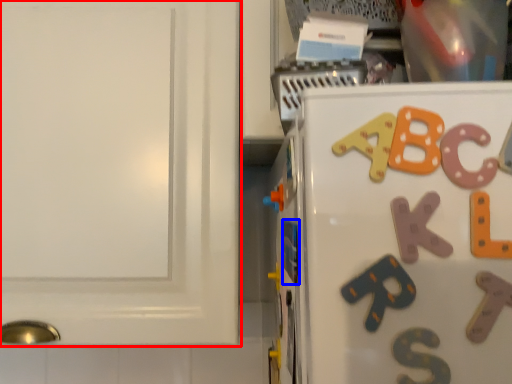
Question: Among these objects, which one is nearest to the camera, cabinetry (highlighted by a red box) or magnet (highlighted by a blue box)?

Choices:
 (A) cabinetry
 (B) magnet

Answer: (B)